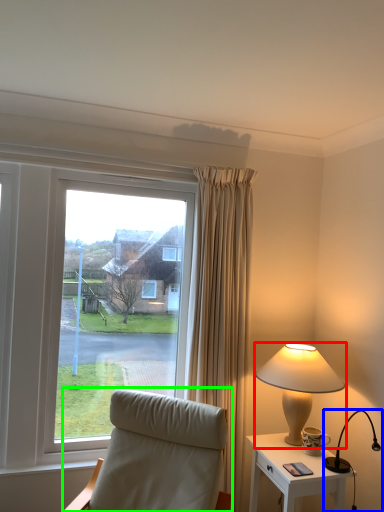
Question: Which is farther away from lamp (highlighted by a red box)? lamp (highlighted by a blue box) or chair (highlighted by a green box)?

Choices:
 (A) lamp
 (B) chair

Answer: (B)